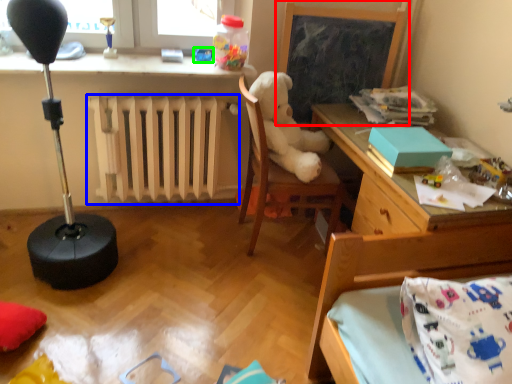
Question: Considering the real-world distances, which object is farthest from bulletin board (highlighted by a red box)? radiator (highlighted by a blue box) or toy (highlighted by a green box)?

Choices:
 (A) radiator
 (B) toy

Answer: (A)